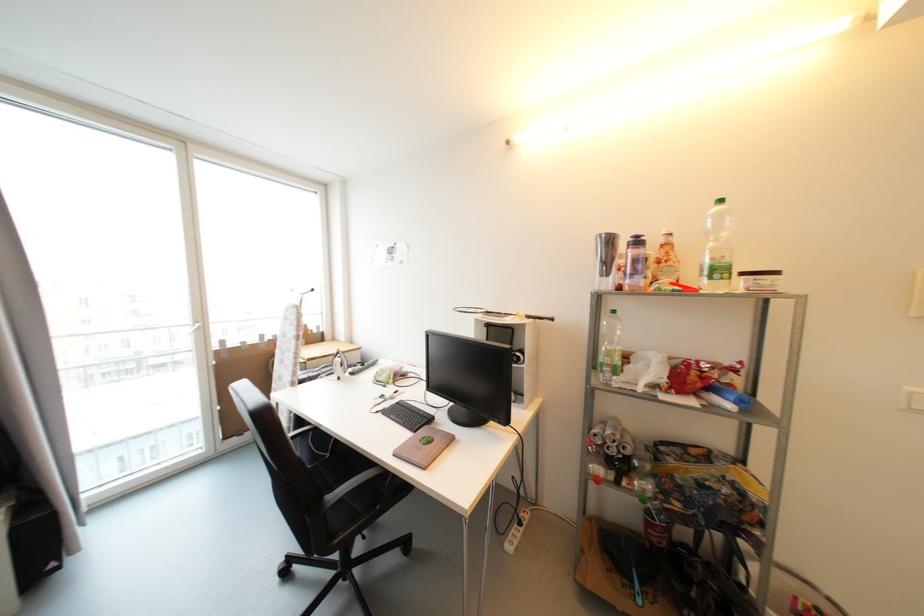
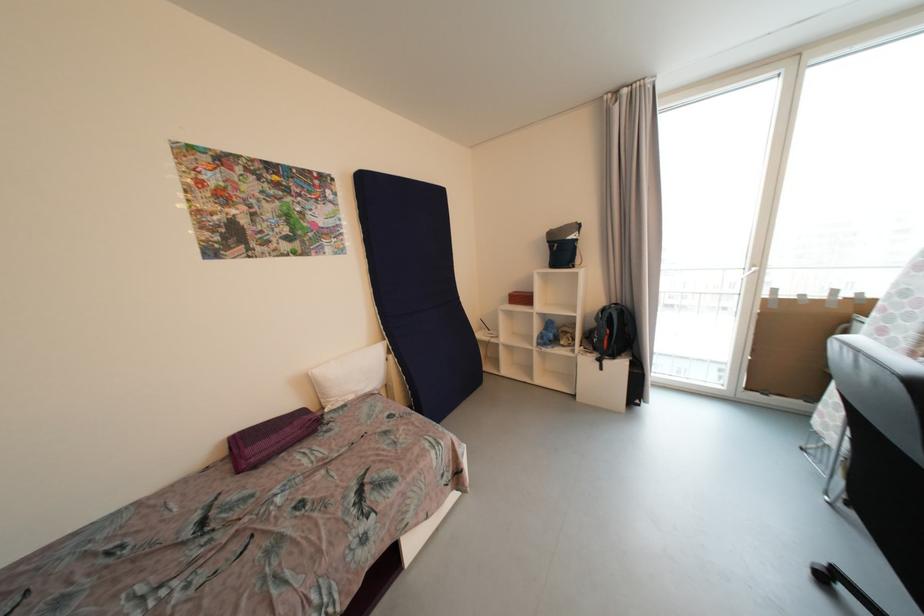
Question: The camera is either moving clockwise (left) or counter-clockwise (right) around the object. The first image is from the beginning of the video and the second image is from the end. Is the camera moving left or right when shooting the video?

Choices:
 (A) Left
 (B) Right

Answer: (B)